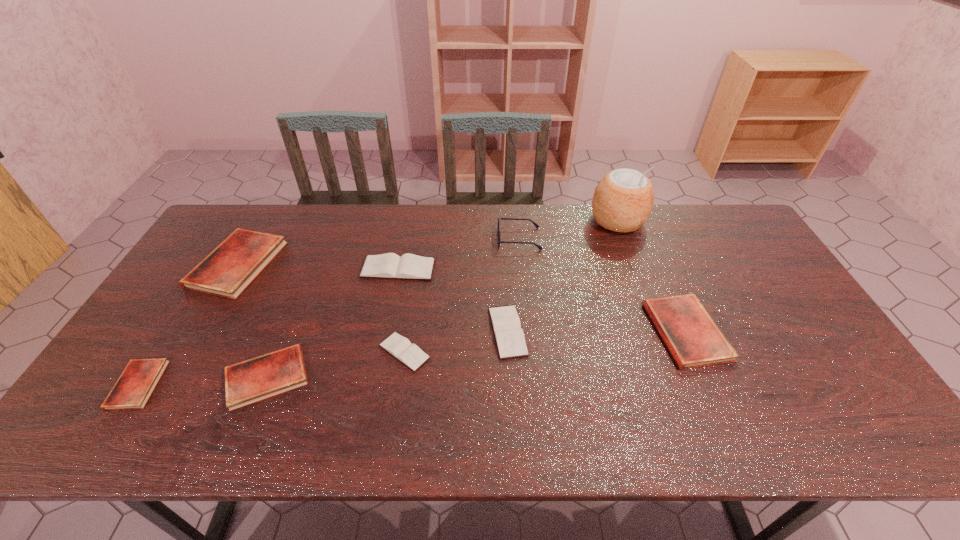
Identify the location of free location at the left edge of the desktop. This screenshot has width=960, height=540. (162, 340).

In the image, there is a desktop. Identify the location of vacant space at the right edge. click(748, 250).

Image resolution: width=960 pixels, height=540 pixels. Identify the location of vacant position at the far left corner of the desktop. (233, 212).

The height and width of the screenshot is (540, 960). Identify the location of free space at the near left corner of the desktop. (138, 444).

Identify the location of vacant space at the far right corner of the desktop. (712, 225).

Where is `empty space between the biggest red diary and the second smallest brown diary`? The image size is (960, 540). empty space between the biggest red diary and the second smallest brown diary is located at coordinates (372, 298).

You are a GUI agent. You are given a task and a screenshot of the screen. Output one action in this format:
    pyautogui.click(x=<x>, y=<y>)
    Task: Click on the free spot between the third object from left to right and the farthest brown diary
    
    Given the screenshot: What is the action you would take?
    pyautogui.click(x=332, y=323)

Image resolution: width=960 pixels, height=540 pixels. What are the coordinates of `empty space between the second red diary from right to left and the coconut` in the screenshot? It's located at (443, 299).

The image size is (960, 540). Identify the location of empty location between the smallest brown diary and the rightmost brown diary. (x=456, y=342).

In order to click on free space between the biggest brown diary and the fifth diary from right to left in this screenshot , I will do `click(332, 323)`.